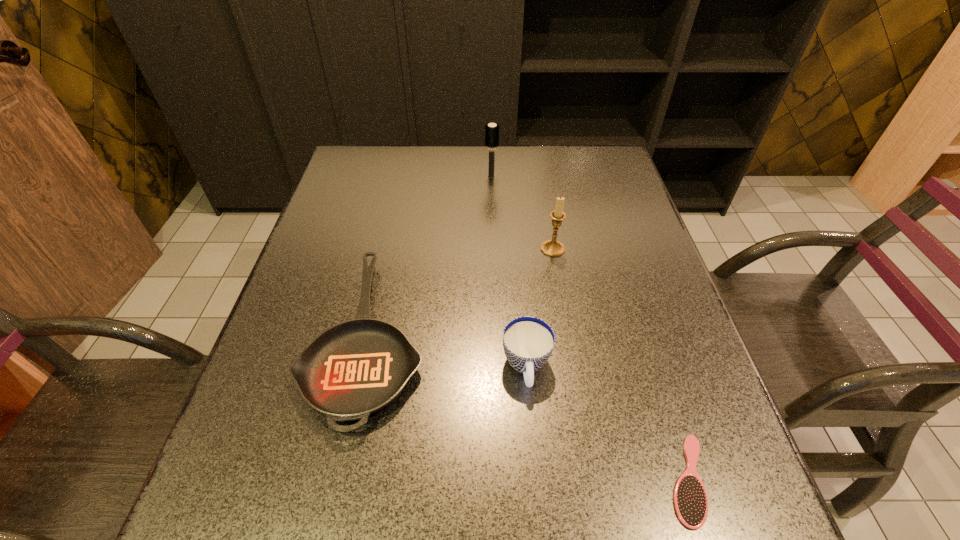
I want to click on empty space between the third tallest object and the taller hairbrush, so click(x=509, y=272).

Where is `free space that is in between the frying pan and the third tallest object`? Image resolution: width=960 pixels, height=540 pixels. free space that is in between the frying pan and the third tallest object is located at coordinates (447, 352).

Identify the location of unoccupied position between the fourth tallest object and the right hairbrush. (x=528, y=408).

Locate an element on the screen. The height and width of the screenshot is (540, 960). free space between the cup and the frying pan is located at coordinates (447, 352).

Locate which object ranks in proximity to the fourth object from left to right. Please provide its 2D coordinates. Your answer should be formatted as a tuple, i.e. [(x, y)], where the tuple contains the x and y coordinates of a point satisfying the conditions above.

[(528, 342)]

Identify which object is the third nearest to the frying pan. Please provide its 2D coordinates. Your answer should be formatted as a tuple, i.e. [(x, y)], where the tuple contains the x and y coordinates of a point satisfying the conditions above.

[(491, 130)]

Where is `vacant region that satisfies the following two spatial constraints: 1. on the side of the cup with the handle; 2. on the right side of the nearer hairbrush`? The height and width of the screenshot is (540, 960). vacant region that satisfies the following two spatial constraints: 1. on the side of the cup with the handle; 2. on the right side of the nearer hairbrush is located at coordinates (536, 480).

Find the location of `free spot that satisfies the following two spatial constraints: 1. on the front side of the left hairbrush; 2. on the left side of the candle holder`. free spot that satisfies the following two spatial constraints: 1. on the front side of the left hairbrush; 2. on the left side of the candle holder is located at coordinates (493, 249).

Find the location of `free space that satisfies the following two spatial constraints: 1. on the front side of the right hairbrush; 2. on the left side of the fourth object from left to right`. free space that satisfies the following two spatial constraints: 1. on the front side of the right hairbrush; 2. on the left side of the fourth object from left to right is located at coordinates pos(592,480).